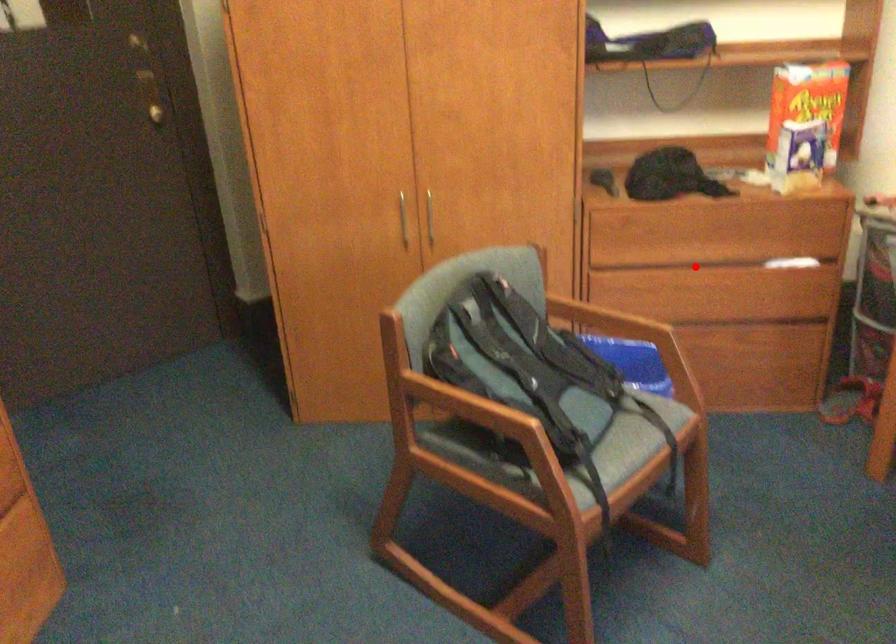
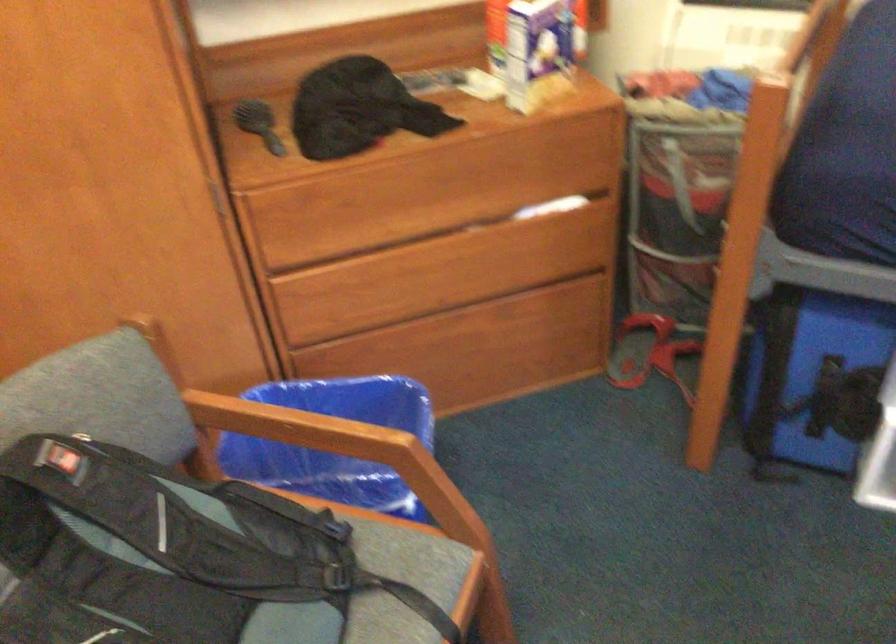
Find the pixel in the second image that matches the highlighted location in the first image.

(420, 238)